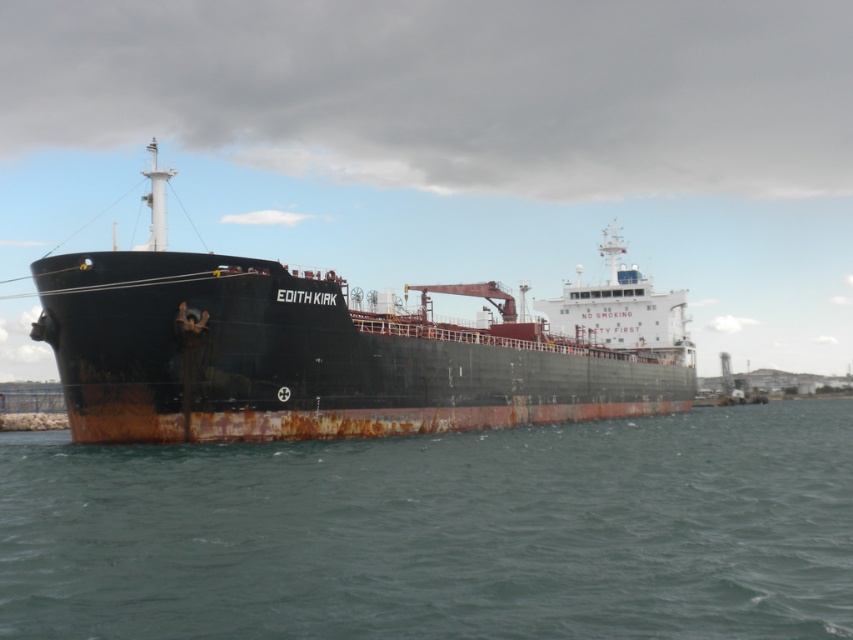
You are standing on the deck of the EDITH KIRK and need to move from the crane to the safety sign. The crane is located at point (355, 554) and the safety sign is at point (196, 346). Which point should you move towards first to reach the safety sign?

You should move towards point (196, 346) first because it is the location of the safety sign you want to reach.